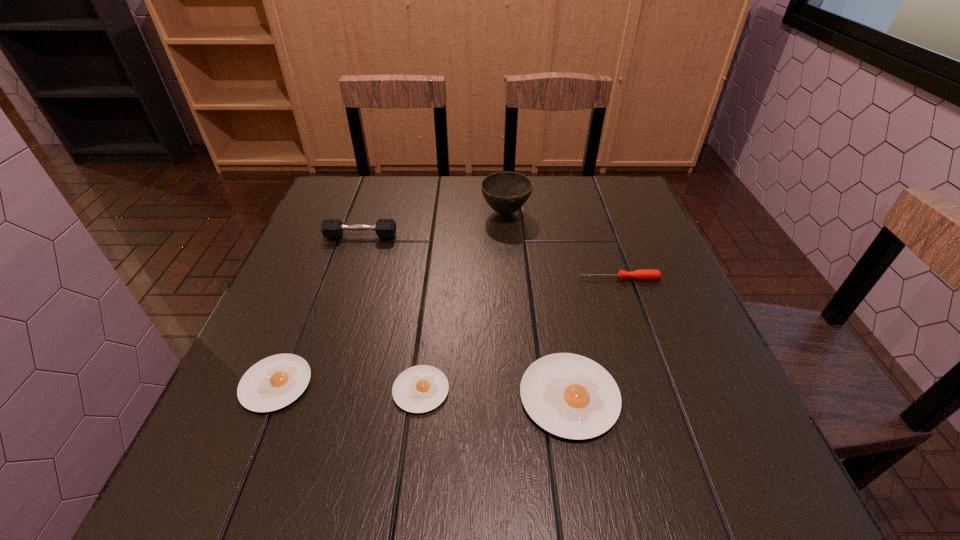
Select which object appears as the second closest to the screwdriver. Please provide its 2D coordinates. Your answer should be formatted as a tuple, i.e. [(x, y)], where the tuple contains the x and y coordinates of a point satisfying the conditions above.

[(571, 396)]

In order to click on the fourth closest object to the rightmost egg yolk in this screenshot , I will do `click(506, 192)`.

The image size is (960, 540). Find the location of `egg yolk that is the closest one to the rightmost egg yolk`. egg yolk that is the closest one to the rightmost egg yolk is located at coordinates (422, 388).

Identify which egg yolk is the nearest to the dumbbell. Please provide its 2D coordinates. Your answer should be formatted as a tuple, i.e. [(x, y)], where the tuple contains the x and y coordinates of a point satisfying the conditions above.

[(276, 381)]

The width and height of the screenshot is (960, 540). What are the coordinates of `free space that satisfies the following two spatial constraints: 1. at the tip of the screwdriver; 2. on the front side of the rightmost egg yolk` in the screenshot? It's located at (660, 396).